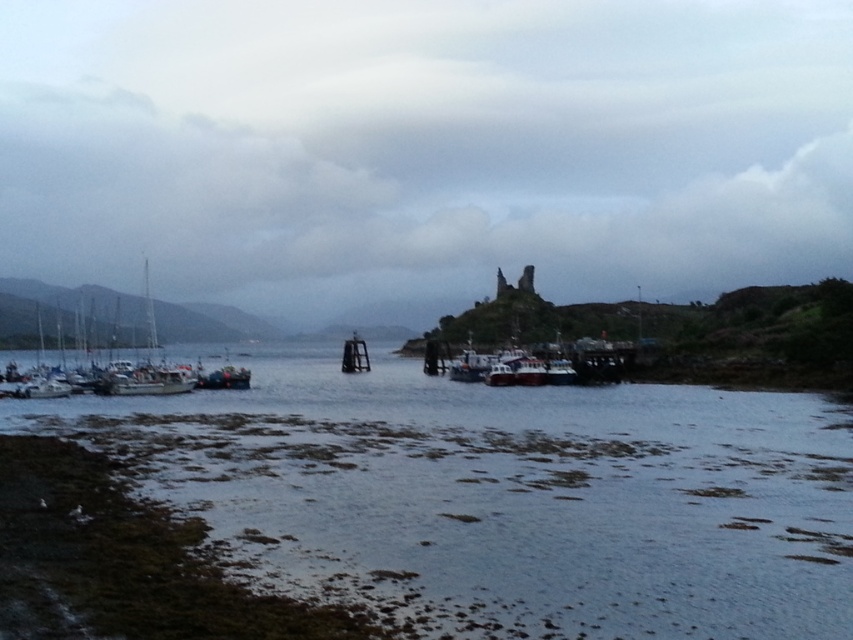
Who is lower down, smooth water at center or black matte dock at center?

smooth water at center is lower down.

You are a GUI agent. You are given a task and a screenshot of the screen. Output one action in this format:
    pyautogui.click(x=<x>, y=<y>)
    Task: Click on the smooth water at center
    
    Given the screenshot: What is the action you would take?
    pyautogui.click(x=503, y=497)

Is point (454, 403) farther from viewer compared to point (366, 358)?

No, it is not.

Identify the location of smooth water at center. (503, 497).

Is white matte sailboat at left wider than black matte dock at center?

Indeed, white matte sailboat at left has a greater width compared to black matte dock at center.

Is white matte sailboat at left smaller than black matte dock at center?

Incorrect, white matte sailboat at left is not smaller in size than black matte dock at center.

Locate an element on the screen. This screenshot has height=640, width=853. white matte sailboat at left is located at coordinates (148, 364).

Does smooth water at center appear on the left side of white matte sailboat at left?

In fact, smooth water at center is to the right of white matte sailboat at left.

Is smooth water at center wider than white matte sailboat at left?

No.

The width and height of the screenshot is (853, 640). What do you see at coordinates (503, 497) in the screenshot? I see `smooth water at center` at bounding box center [503, 497].

The height and width of the screenshot is (640, 853). In order to click on smooth water at center in this screenshot , I will do `click(503, 497)`.